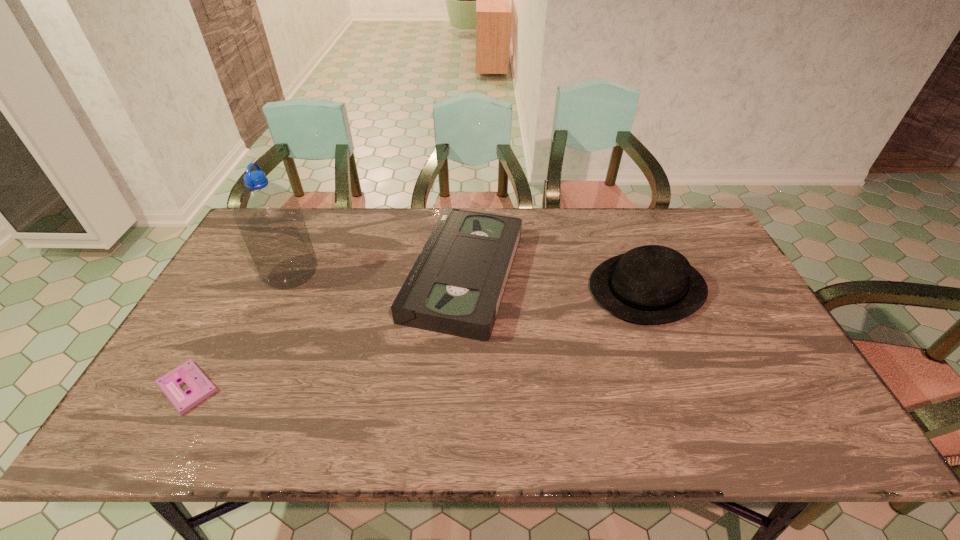
Where is `vacant space at the near left corner`? Image resolution: width=960 pixels, height=540 pixels. vacant space at the near left corner is located at coordinates (180, 440).

In the image, there is a desktop. Where is `vacant area at the far right corner`? The width and height of the screenshot is (960, 540). vacant area at the far right corner is located at coordinates (675, 234).

Identify the location of vacant area that lies between the shortest object and the rightmost object. coord(418,338).

Locate an element on the screen. free point between the fedora and the shorter videotape is located at coordinates (418, 338).

Locate an element on the screen. This screenshot has width=960, height=540. vacant area that lies between the taller videotape and the shorter videotape is located at coordinates (325, 330).

Where is `free space between the right videotape and the rightmost object`? Image resolution: width=960 pixels, height=540 pixels. free space between the right videotape and the rightmost object is located at coordinates (556, 281).

This screenshot has height=540, width=960. What are the coordinates of `vacant area between the nearer videotape and the right videotape` in the screenshot? It's located at (325, 330).

Locate an element on the screen. vacant area that lies between the shorter videotape and the tallest object is located at coordinates (239, 330).

Identify the location of free spot between the shorter videotape and the rightmost object. (418, 338).

I want to click on object that is the second nearest to the second object from right to left, so [x=268, y=216].